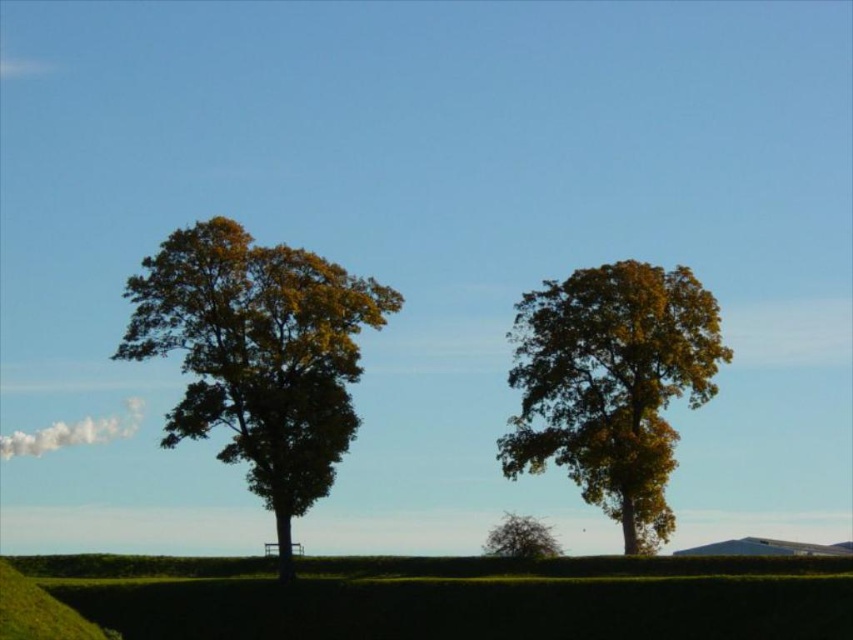
Question: Which object appears farthest from the camera in this image?

Choices:
 (A) green leafy tree at left
 (B) golden textured tree at center
 (C) green leafy tree at lower center

Answer: (C)

Question: Does green leafy tree at left have a lesser width compared to golden textured tree at center?

Choices:
 (A) yes
 (B) no

Answer: (B)

Question: Does golden textured tree at center appear on the left side of green leafy tree at lower center?

Choices:
 (A) yes
 (B) no

Answer: (B)

Question: Estimate the real-world distances between objects in this image. Which object is farther from the green grassy hillside at lower center?

Choices:
 (A) green leafy tree at left
 (B) green leafy tree at lower center

Answer: (B)

Question: Can you confirm if green grassy hillside at lower center is positioned to the left of green leafy tree at left?

Choices:
 (A) yes
 (B) no

Answer: (A)

Question: Which point is closer to the camera?

Choices:
 (A) (679, 282)
 (B) (296, 637)
 (C) (254, 260)

Answer: (B)